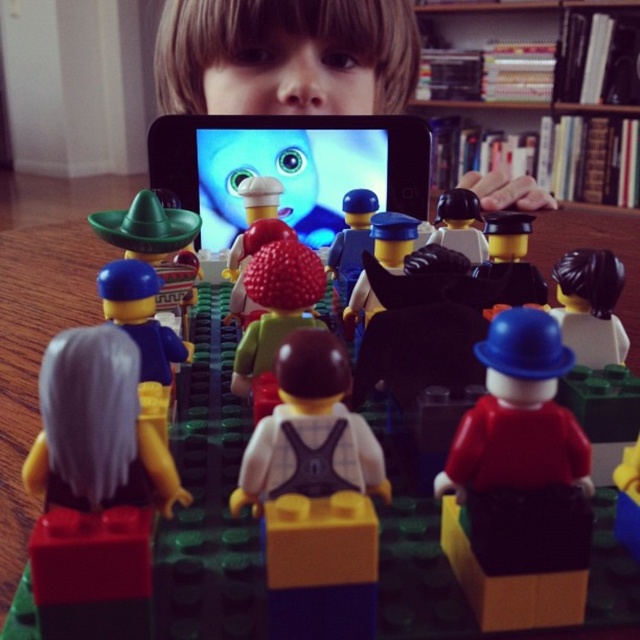
You are a small LEGO minifigure standing on the green baseplate. You want to reach the wooden bookshelf at upper center but there is a green plastic sombrero at left in your way. Can you walk around it to get to the bookshelf?

The wooden bookshelf at upper center is further to the viewer than the green plastic sombrero at left, so you can walk around the green plastic sombrero at left to reach the wooden bookshelf at upper center.

You are a LEGO minifigure standing on the green baseplate and want to reach the wooden bookshelf at upper center. There is a green plastic sombrero at left in your way. Which direction should you move to avoid it?

The wooden bookshelf at upper center is positioned on the right side of the green plastic sombrero at left, so you should move to the right to avoid the green plastic sombrero at left and reach the wooden bookshelf at upper center.